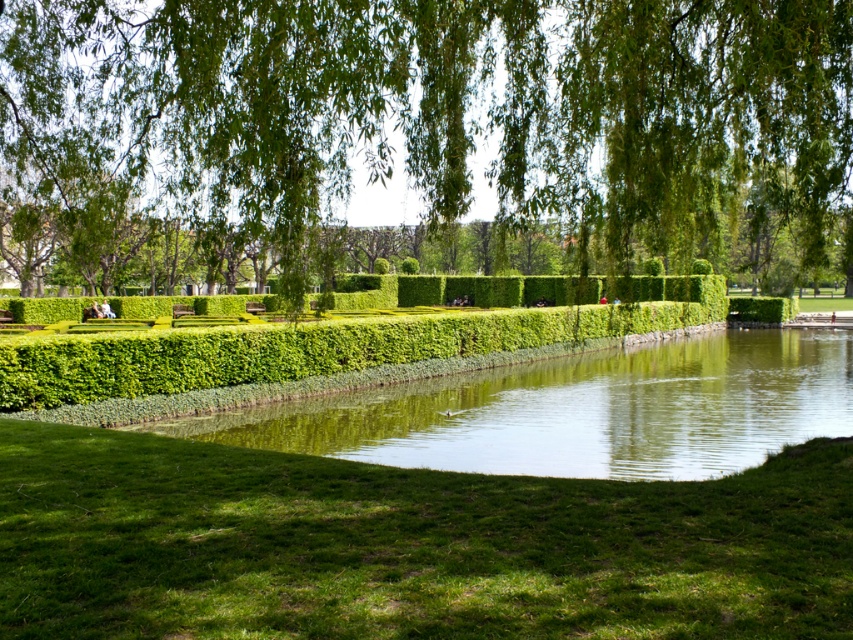
Question: Among these points, which one is nearest to the camera?

Choices:
 (A) (432, 276)
 (B) (67, 388)
 (C) (386, 406)
 (D) (366, 541)

Answer: (D)

Question: Which of the following is the closest to the observer?

Choices:
 (A) (250, 356)
 (B) (544, 422)
 (C) (474, 35)

Answer: (C)

Question: Does green leafy willow at upper center have a lesser width compared to green leafy hedge at center?

Choices:
 (A) no
 (B) yes

Answer: (A)

Question: Is green leafy willow at upper center positioned at the back of green smooth water at center?

Choices:
 (A) no
 (B) yes

Answer: (A)

Question: Where is green grass at lower center located in relation to green smooth water at center in the image?

Choices:
 (A) right
 (B) left

Answer: (B)

Question: Which point is closer to the camera taking this photo?

Choices:
 (A) (28, 595)
 (B) (399, 138)

Answer: (A)